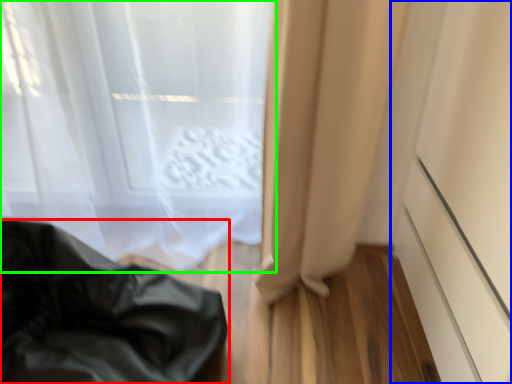
Question: Considering the real-world distances, which object is farthest from furniture (highlighted by a red box)? screen door (highlighted by a blue box) or curtain (highlighted by a green box)?

Choices:
 (A) screen door
 (B) curtain

Answer: (A)